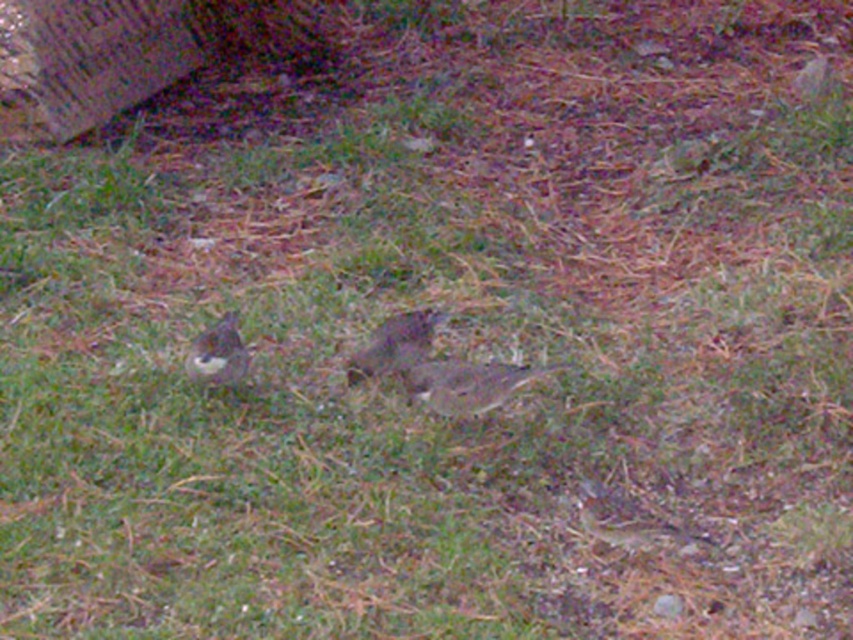
Between point (502, 384) and point (242, 378), which one is positioned behind?

The point (242, 378) is behind.

Between brown feathered bird at center and brown speckled bird at lower left, which one has more height?

brown speckled bird at lower left is taller.

Who is more forward, (451, 365) or (231, 380)?

Positioned in front is point (451, 365).

Where is `brown feathered bird at center`? brown feathered bird at center is located at coordinates (463, 385).

Measure the distance from brown feathered bird at center to brown matte bird at center.

8.31 inches

Between brown feathered bird at center and brown matte bird at center, which one is positioned higher?

Positioned higher is brown matte bird at center.

Who is more distant from viewer, (x=453, y=369) or (x=392, y=356)?

Positioned behind is point (x=392, y=356).

Locate an element on the screen. brown feathered bird at center is located at coordinates (463, 385).

Is brown matte bird at center behind brown speckled bird at lower left?

Yes, brown matte bird at center is behind brown speckled bird at lower left.

Who is positioned more to the left, brown matte bird at center or brown speckled bird at lower left?

brown speckled bird at lower left

Is point (349, 364) positioned after point (233, 323)?

Yes, it is behind point (233, 323).

What are the coordinates of `brown matte bird at center` in the screenshot? It's located at (393, 346).